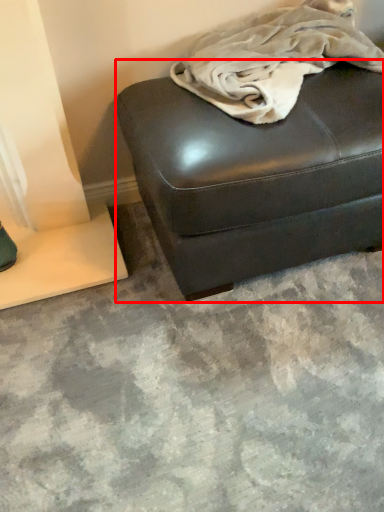
Question: From the image's perspective, where is furniture (annotated by the red box) located in relation to blanket in the image?

Choices:
 (A) below
 (B) above

Answer: (A)